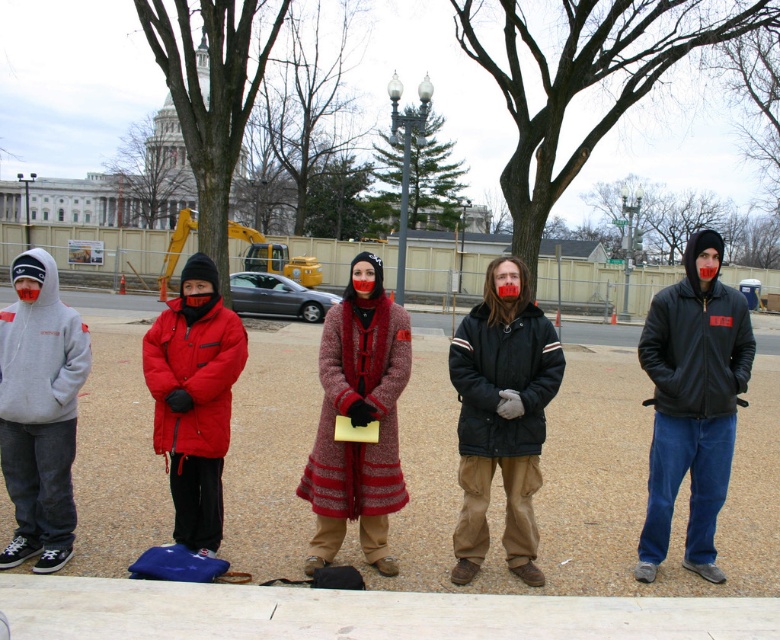
Question: Is dark brown leather jacket at center closer to the viewer compared to gray hoodie at left?

Choices:
 (A) yes
 (B) no

Answer: (B)

Question: Which of these objects is positioned farthest from the dark brown leather jacket at center?

Choices:
 (A) gray hoodie at left
 (B) matte red puffer jacket at center
 (C) black leather jacket at center
 (D) knitted wool coat at center

Answer: (A)

Question: Can you confirm if black leather jacket at center is positioned below gray hoodie at left?

Choices:
 (A) no
 (B) yes

Answer: (B)

Question: Which point is closer to the camera taking this photo?

Choices:
 (A) (474, 483)
 (B) (30, 486)
 (C) (679, 300)

Answer: (B)

Question: Is the position of knitted wool coat at center more distant than that of gray hoodie at left?

Choices:
 (A) no
 (B) yes

Answer: (B)

Question: Which object is closer to the camera taking this photo?

Choices:
 (A) knitted wool coat at center
 (B) dark brown leather jacket at center

Answer: (A)